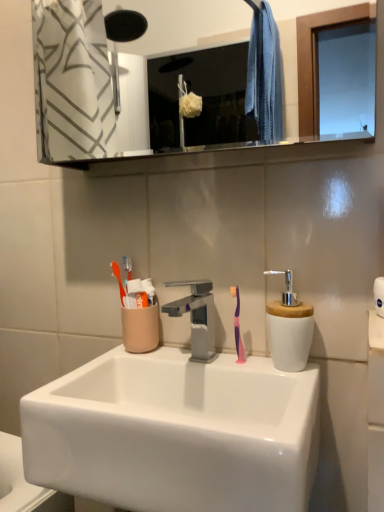
I want to click on white paper towel at right, so click(x=376, y=331).

What are the coordinates of `pink rubber toothbrush at center` in the screenshot? It's located at (238, 327).

The width and height of the screenshot is (384, 512). In order to click on satin nickel faucet at center in this screenshot , I will do `click(196, 316)`.

The width and height of the screenshot is (384, 512). Describe the element at coordinates (176, 432) in the screenshot. I see `white glossy sink at center` at that location.

Measure the distance between white glossy sink at center and camera.

white glossy sink at center is 50.16 centimeters from camera.

Locate an element on the screen. The height and width of the screenshot is (512, 384). clear glass mirror at upper center is located at coordinates click(x=144, y=90).

What do you see at coordinates (289, 328) in the screenshot?
I see `white ceramic soap dispenser at right` at bounding box center [289, 328].

The image size is (384, 512). I want to click on white paper towel at right, so click(x=376, y=331).

From the picture: Who is taller, clear glass mirror at upper center or pink rubber toothbrush at center?

clear glass mirror at upper center.

Is clear glass mirror at upper center far from pink rubber toothbrush at center?

Indeed, clear glass mirror at upper center is not near pink rubber toothbrush at center.

Is clear glass mirror at upper center wider than pink rubber toothbrush at center?

Yes, clear glass mirror at upper center is wider than pink rubber toothbrush at center.

From a real-world perspective, is clear glass mirror at upper center positioned under pink rubber toothbrush at center based on gravity?

No.

Can you see pink rubber toothbrush at center touching clear glass mirror at upper center?

No, pink rubber toothbrush at center is not in contact with clear glass mirror at upper center.

Could you tell me if pink rubber toothbrush at center is turned towards clear glass mirror at upper center?

No, pink rubber toothbrush at center is not oriented towards clear glass mirror at upper center.

Between pink rubber toothbrush at center and clear glass mirror at upper center, which one has less height?

pink rubber toothbrush at center is shorter.

From the image's perspective, is pink rubber toothbrush at center above or below clear glass mirror at upper center?

From the image's perspective, pink rubber toothbrush at center appears below clear glass mirror at upper center.

I want to click on toothbrush that appears on the right of white glossy sink at center, so click(238, 327).

From the image's perspective, is white glossy sink at center beneath pink rubber toothbrush at center?

Yes, from the image's perspective, white glossy sink at center is beneath pink rubber toothbrush at center.

From a real-world perspective, who is located lower, white glossy sink at center or pink rubber toothbrush at center?

white glossy sink at center is physically lower.

Which of these two, white glossy sink at center or pink rubber toothbrush at center, is thinner?

pink rubber toothbrush at center is thinner.

Based on the photo, visually, is white ceramic soap dispenser at right positioned to the left or to the right of white paper towel at right?

In the image, white ceramic soap dispenser at right appears on the left side of white paper towel at right.

Considering the sizes of objects white ceramic soap dispenser at right and white paper towel at right in the image provided, who is shorter, white ceramic soap dispenser at right or white paper towel at right?

Standing shorter between the two is white paper towel at right.

Is white ceramic soap dispenser at right in contact with white paper towel at right?

There is a gap between white ceramic soap dispenser at right and white paper towel at right.

From the image's perspective, does white ceramic soap dispenser at right appear lower than white paper towel at right?

Yes.

Can you confirm if white paper towel at right is positioned to the left of clear glass mirror at upper center?

No, white paper towel at right is not to the left of clear glass mirror at upper center.

Between point (375, 322) and point (90, 111), which one is positioned in front?

The point (375, 322) is closer to the camera.

Where is `mirror above the white paper towel at right (from a real-world perspective)`? mirror above the white paper towel at right (from a real-world perspective) is located at coordinates (144, 90).

Is white glossy sink at center touching white ceramic soap dispenser at right?

No, white glossy sink at center is not touching white ceramic soap dispenser at right.

From a real-world perspective, which object rests below the other?

From a 3D spatial view, white glossy sink at center is below.

Between white glossy sink at center and white ceramic soap dispenser at right, which one has less height?

white ceramic soap dispenser at right is shorter.

Is white glossy sink at center aimed at white ceramic soap dispenser at right?

No, white glossy sink at center is not turned towards white ceramic soap dispenser at right.

Is pink rubber toothbrush at center located outside satin nickel faucet at center?

Absolutely, pink rubber toothbrush at center is external to satin nickel faucet at center.

Could you tell me if pink rubber toothbrush at center is turned towards satin nickel faucet at center?

No, pink rubber toothbrush at center is not oriented towards satin nickel faucet at center.

Which object is further away from the camera taking this photo, pink rubber toothbrush at center or satin nickel faucet at center?

Positioned behind is pink rubber toothbrush at center.

This screenshot has width=384, height=512. I want to click on mirror above the pink rubber toothbrush at center (from the image's perspective), so click(144, 90).

At what (x,y) coordinates should I click in order to perform the action: click on toothbrush located below the clear glass mirror at upper center (from the image's perspective). Please return your answer as a coordinate pair (x, y). Looking at the image, I should click on (238, 327).

Looking at the image, which one is located closer to satin nickel faucet at center, white glossy sink at center or white paper towel at right?

Among the two, white glossy sink at center is located nearer to satin nickel faucet at center.

Estimate the real-world distances between objects in this image. Which object is closer to satin nickel faucet at center, white ceramic soap dispenser at right or white paper towel at right?

Based on the image, white ceramic soap dispenser at right appears to be nearer to satin nickel faucet at center.

Consider the image. When comparing their distances from white paper towel at right, does white ceramic soap dispenser at right or pink rubber toothbrush at center seem further?

pink rubber toothbrush at center.

Based on their spatial positions, is white paper towel at right or satin nickel faucet at center further from white ceramic soap dispenser at right?

satin nickel faucet at center is positioned further to the anchor white ceramic soap dispenser at right.

Which object lies further to the anchor point white ceramic soap dispenser at right, clear glass mirror at upper center or white glossy sink at center?

clear glass mirror at upper center is positioned further to the anchor white ceramic soap dispenser at right.

Considering their positions, is white ceramic soap dispenser at right positioned further to white paper towel at right than satin nickel faucet at center?

Among the two, satin nickel faucet at center is located further to white paper towel at right.

Based on their spatial positions, is pink rubber toothbrush at center or white ceramic soap dispenser at right further from clear glass mirror at upper center?

pink rubber toothbrush at center.

When comparing their distances from white glossy sink at center, does satin nickel faucet at center or white paper towel at right seem further?

Among the two, white paper towel at right is located further to white glossy sink at center.

Identify the location of toothbrush between white glossy sink at center and white paper towel at right in the horizontal direction. Image resolution: width=384 pixels, height=512 pixels. (238, 327).

Find the location of a particular element. Image resolution: width=384 pixels, height=512 pixels. soap dispenser between clear glass mirror at upper center and pink rubber toothbrush at center in the up-down direction is located at coordinates (289, 328).

The width and height of the screenshot is (384, 512). Find the location of `toothbrush between satin nickel faucet at center and white ceramic soap dispenser at right in the horizontal direction`. toothbrush between satin nickel faucet at center and white ceramic soap dispenser at right in the horizontal direction is located at coordinates (238, 327).

I want to click on soap dispenser between satin nickel faucet at center and white paper towel at right from left to right, so 289,328.